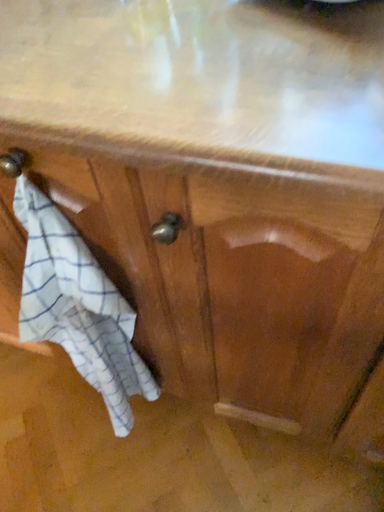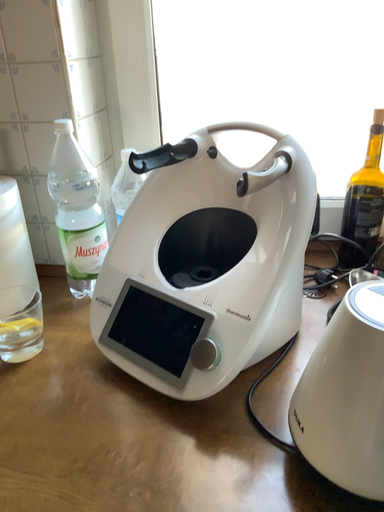
Question: Which way did the camera rotate in the video?

Choices:
 (A) rotated left
 (B) rotated right

Answer: (B)